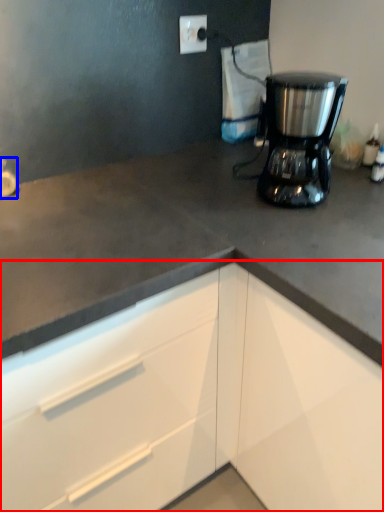
Question: Which of the following is the closest to the observer, cabinetry (highlighted by a red box) or faucet (highlighted by a blue box)?

Choices:
 (A) cabinetry
 (B) faucet

Answer: (A)